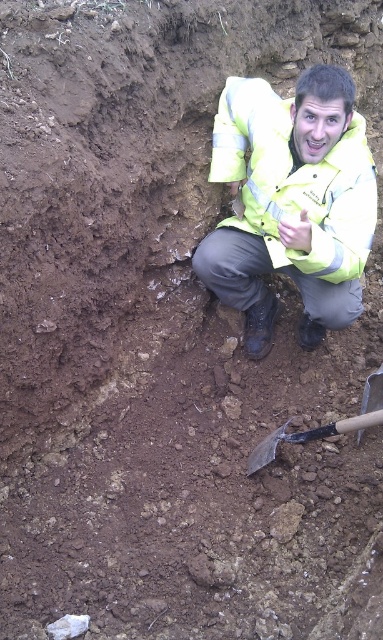
Question: Can you confirm if yellow reflective jacket at center is positioned to the left of wooden handle shovel at lower center?

Choices:
 (A) no
 (B) yes

Answer: (B)

Question: Is yellow reflective jacket at center further to the viewer compared to wooden handle shovel at lower center?

Choices:
 (A) no
 (B) yes

Answer: (A)

Question: Among these objects, which one is farthest from the camera?

Choices:
 (A) wooden handle shovel at lower center
 (B) yellow reflective jacket at center

Answer: (A)

Question: Which object appears farthest from the camera in this image?

Choices:
 (A) yellow reflective jacket at center
 (B) wooden handle shovel at lower center

Answer: (B)

Question: Does yellow reflective jacket at center appear under wooden handle shovel at lower center?

Choices:
 (A) yes
 (B) no

Answer: (B)

Question: Which of the following is the closest to the observer?

Choices:
 (A) yellow reflective jacket at center
 (B) wooden handle shovel at lower center

Answer: (A)